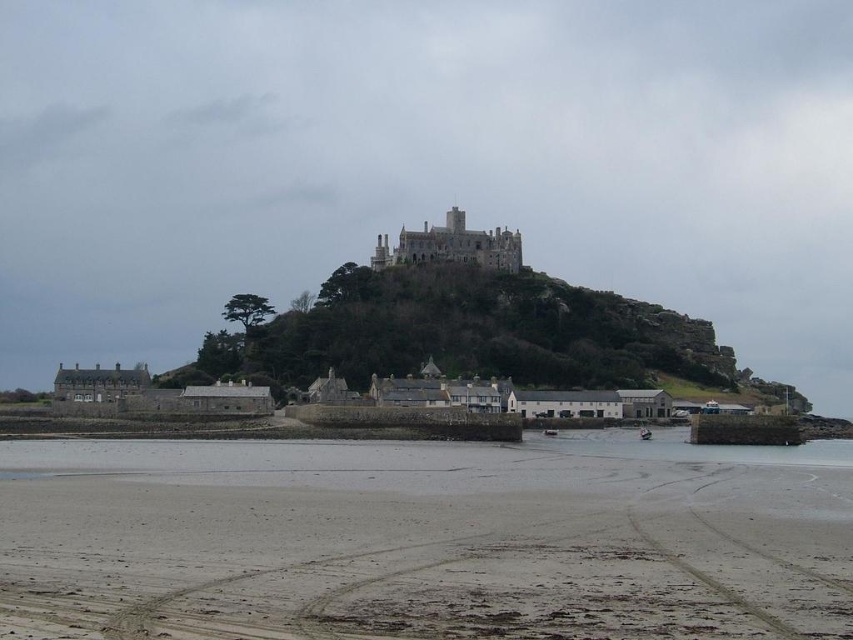
Question: Among these objects, which one is nearest to the camera?

Choices:
 (A) clear water at lower center
 (B) dark gray stone castle at center
 (C) sandy beach at lower center
 (D) green grassy hill at center

Answer: (C)

Question: Is sandy beach at lower center bigger than dark gray stone castle at center?

Choices:
 (A) yes
 (B) no

Answer: (A)

Question: Is sandy beach at lower center above clear water at lower center?

Choices:
 (A) yes
 (B) no

Answer: (A)

Question: Which is farther from the clear water at lower center?

Choices:
 (A) green grassy hill at center
 (B) dark gray stone castle at center

Answer: (B)

Question: Which point is closer to the camera taking this photo?

Choices:
 (A) (370, 532)
 (B) (375, 332)
 (C) (558, 449)

Answer: (A)

Question: Can you confirm if sandy beach at lower center is positioned to the left of dark gray stone castle at center?

Choices:
 (A) no
 (B) yes

Answer: (B)